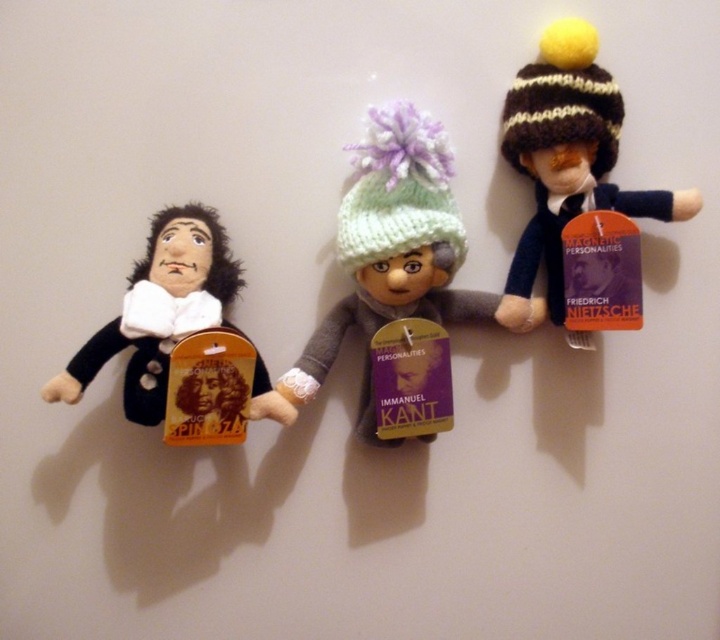
Question: Which of the following is the farthest from the observer?

Choices:
 (A) (279, 378)
 (B) (67, 390)
 (C) (540, 113)

Answer: (A)

Question: Is knitted green hat at center to the right of knitted woolen hat at upper right from the viewer's perspective?

Choices:
 (A) yes
 (B) no

Answer: (B)

Question: Can you confirm if knitted green hat at center is positioned to the right of velvet black doll at left?

Choices:
 (A) yes
 (B) no

Answer: (A)

Question: Estimate the real-world distances between objects in this image. Which object is closer to the knitted woolen hat at upper right?

Choices:
 (A) velvet black doll at left
 (B) knitted green hat at center

Answer: (B)

Question: Can you confirm if knitted woolen hat at upper right is bigger than velvet black doll at left?

Choices:
 (A) no
 (B) yes

Answer: (B)

Question: Which object is the farthest from the knitted woolen hat at upper right?

Choices:
 (A) velvet black doll at left
 (B) knitted green hat at center

Answer: (A)